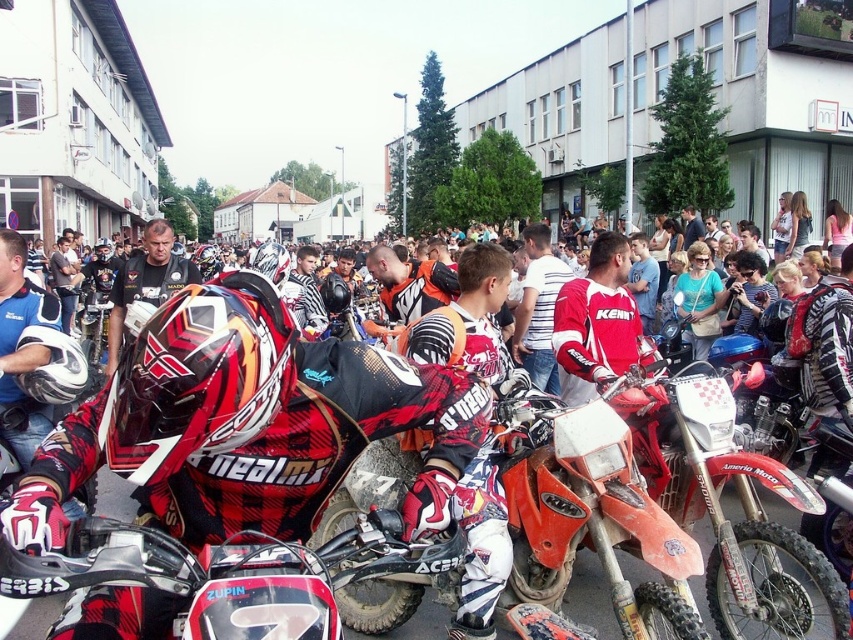
Question: Which is nearer to the red and black motocross suit at center?

Choices:
 (A) red synthetic jacket at center
 (B) white striped shirt at center
 (C) matte black jacket at center

Answer: (A)

Question: Is red synthetic jacket at center above white striped shirt at center?

Choices:
 (A) no
 (B) yes

Answer: (B)

Question: Considering the relative positions of red and black motocross suit at center and white striped shirt at center in the image provided, where is red and black motocross suit at center located with respect to white striped shirt at center?

Choices:
 (A) left
 (B) right

Answer: (A)

Question: Is red and black motocross suit at center to the right of matte black jacket at center from the viewer's perspective?

Choices:
 (A) yes
 (B) no

Answer: (A)

Question: Which point is closer to the camera?

Choices:
 (A) coord(618,310)
 (B) coord(521,353)
 (C) coord(183,285)

Answer: (A)

Question: Which object appears closest to the camera in this image?

Choices:
 (A) matte black jacket at center
 (B) red and black motocross suit at center
 (C) white striped shirt at center

Answer: (B)